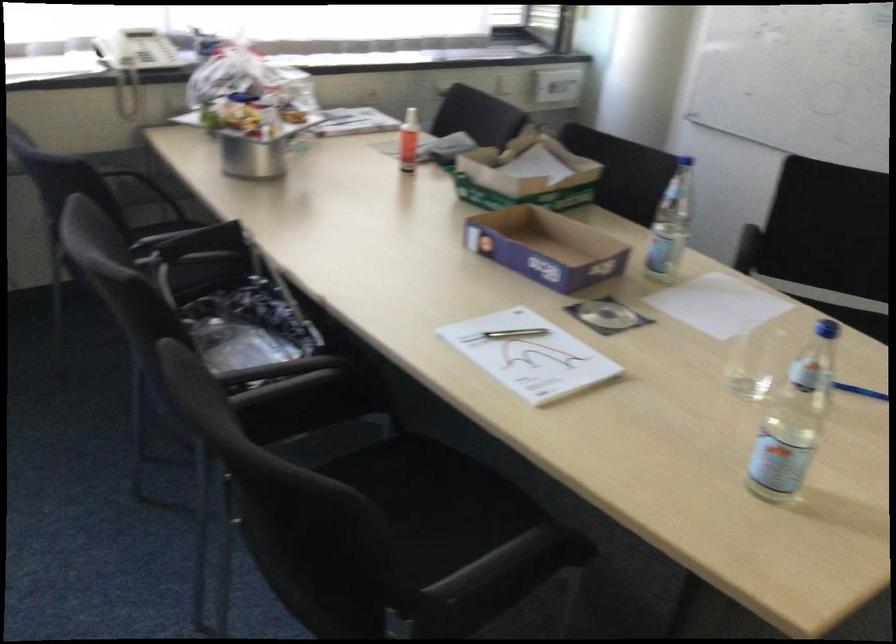
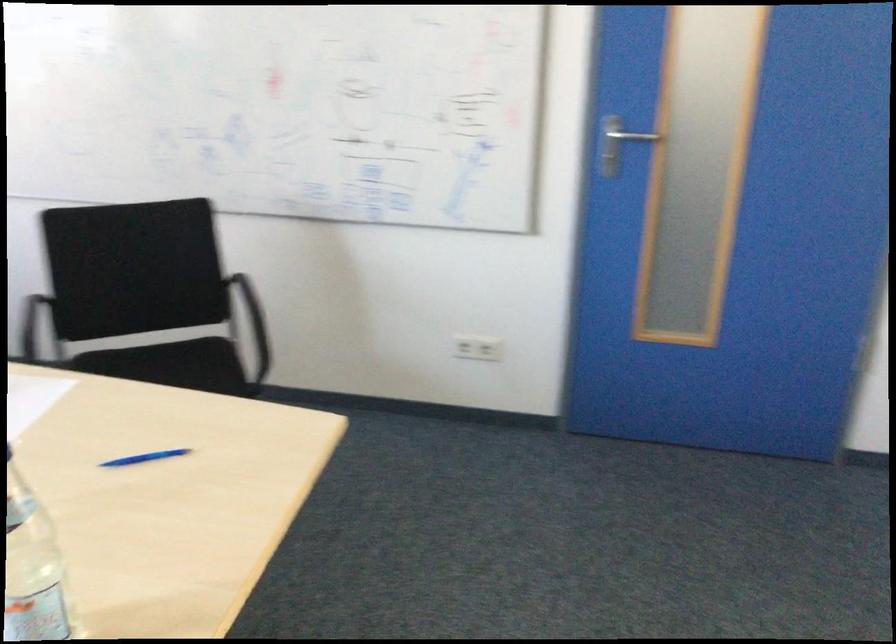
Question: How did the camera likely rotate?

Choices:
 (A) Left
 (B) Right
 (C) Up
 (D) Down

Answer: (B)